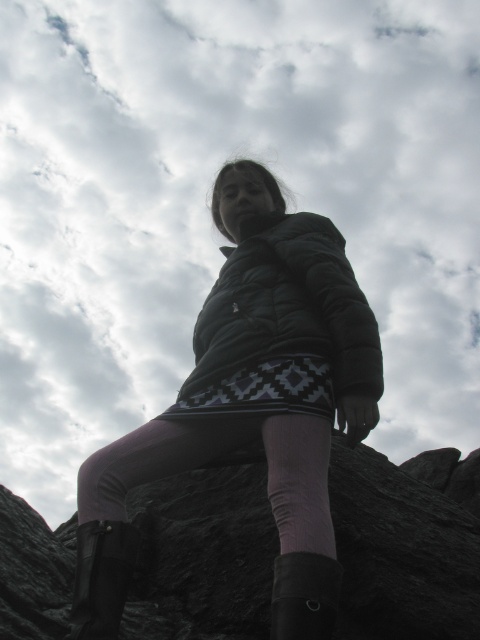
Question: Which object is closer to the camera taking this photo?

Choices:
 (A) black suede boot at lower center
 (B) black puffy jacket at center
 (C) pink fabric sock at lower center
 (D) black rubber boot at lower left

Answer: (A)

Question: Which is farther from the matte black jacket at center?

Choices:
 (A) pink fabric sock at lower center
 (B) black rubber boot at lower left
 (C) black puffy jacket at center

Answer: (B)

Question: From the image, what is the correct spatial relationship of pink fabric sock at lower center in relation to black suede boot at lower center?

Choices:
 (A) left
 (B) right

Answer: (B)

Question: Which point is farther to the camera?

Choices:
 (A) black rubber boot at lower left
 (B) black puffy jacket at center
 (C) matte black jacket at center
 (D) black suede boot at lower center

Answer: (B)

Question: Can you confirm if matte black jacket at center is positioned below black rubber boot at lower left?

Choices:
 (A) yes
 (B) no

Answer: (B)

Question: Is matte black jacket at center to the left of black rubber boot at lower left from the viewer's perspective?

Choices:
 (A) yes
 (B) no

Answer: (B)